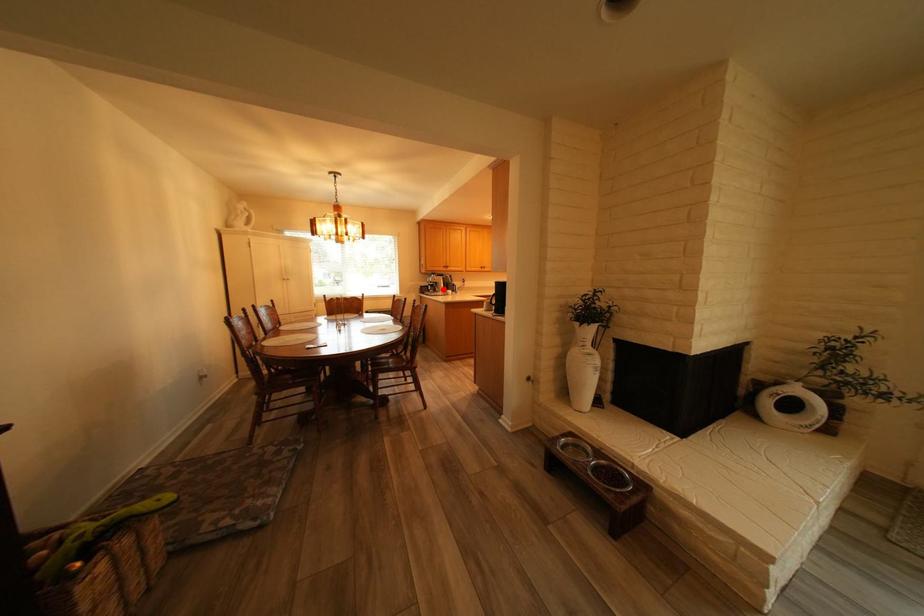
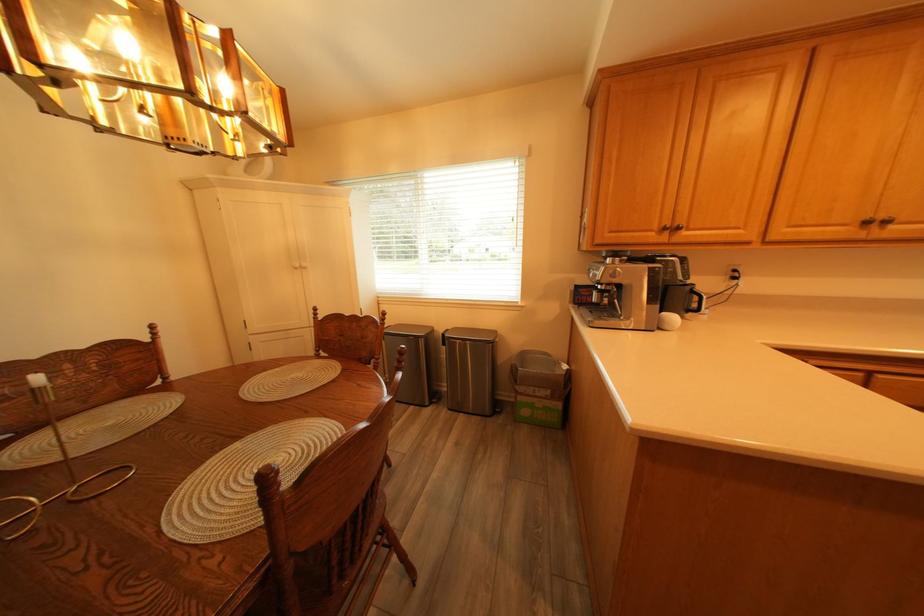
Find the pixel in the second image that matches the highlighted location in the first image.

(609, 301)